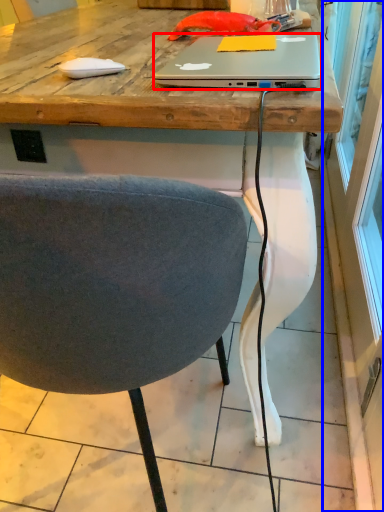
Question: Which object appears closest to the camera in this image, laptop (highlighted by a red box) or screen door (highlighted by a blue box)?

Choices:
 (A) laptop
 (B) screen door

Answer: (B)